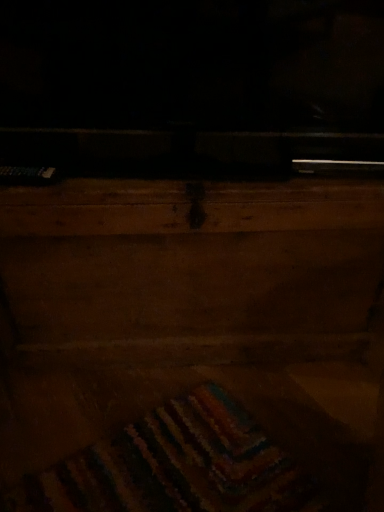
Image resolution: width=384 pixels, height=512 pixels. What do you see at coordinates (190, 344) in the screenshot? I see `wooden rug at lower center` at bounding box center [190, 344].

Image resolution: width=384 pixels, height=512 pixels. I want to click on wooden rug at lower center, so click(x=190, y=344).

This screenshot has height=512, width=384. Find the location of `wooden rug at lower center`. wooden rug at lower center is located at coordinates (190, 344).